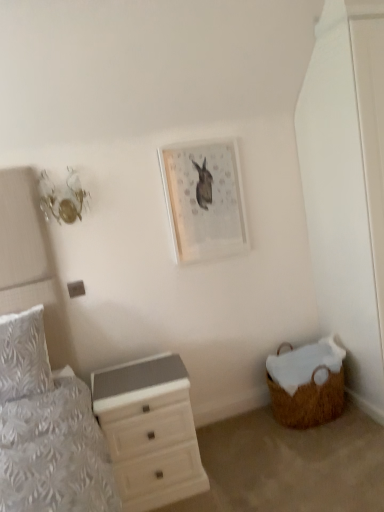
Question: Is woven brown basket at lower right inside or outside of white glossy chest of drawers at lower left?

Choices:
 (A) inside
 (B) outside

Answer: (B)

Question: From a real-world perspective, is woven brown basket at lower right above or below white glossy chest of drawers at lower left?

Choices:
 (A) above
 (B) below

Answer: (B)

Question: Which of these objects is positioned farthest from the matte white picture frame at upper center?

Choices:
 (A) woven brown basket at lower right
 (B) white textured pillow at left
 (C) white glossy chest of drawers at lower left

Answer: (B)

Question: Which object is the closest to the matte white picture frame at upper center?

Choices:
 (A) white glossy chest of drawers at lower left
 (B) white textured pillow at left
 (C) woven brown basket at lower right

Answer: (A)